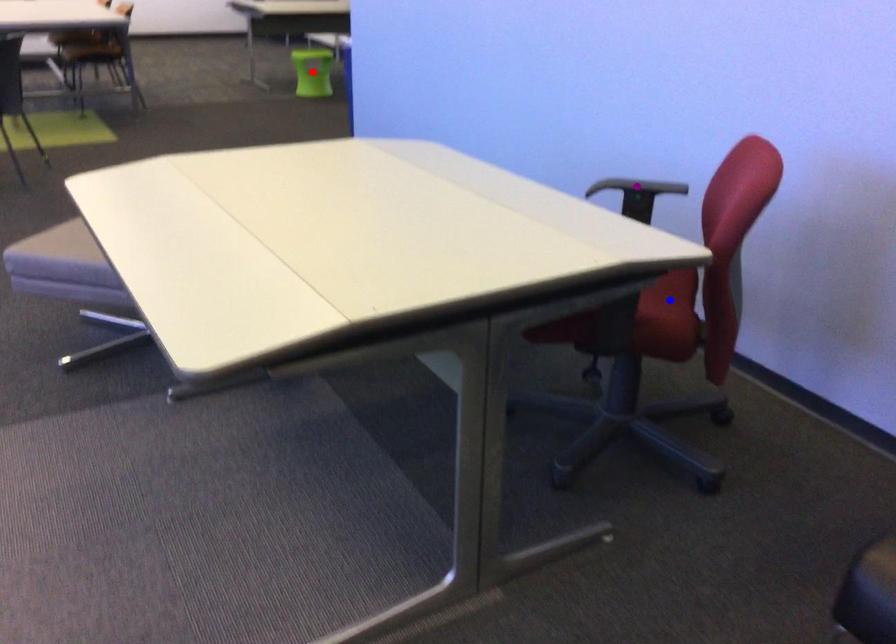
Order these from nearest to farthest:
blue point | red point | purple point

blue point → purple point → red point